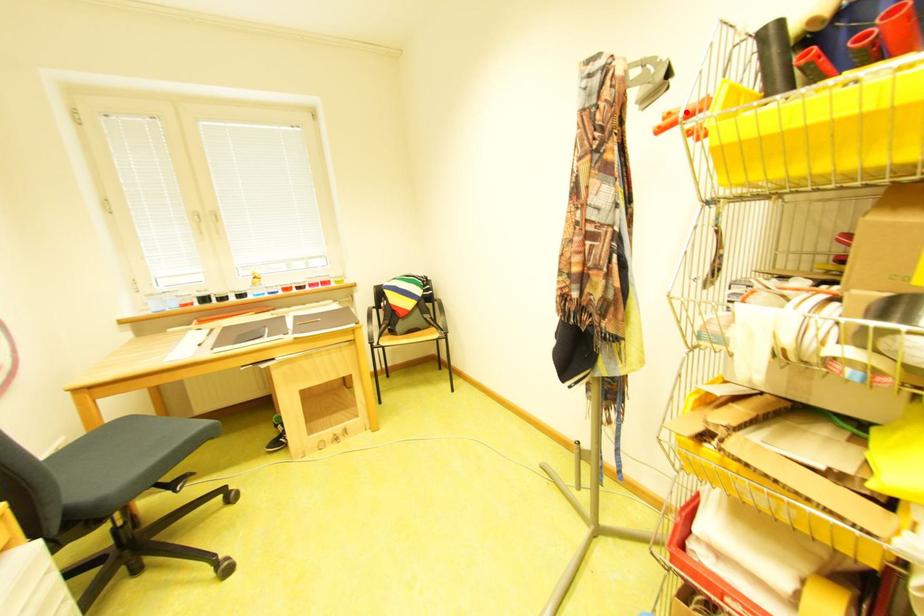
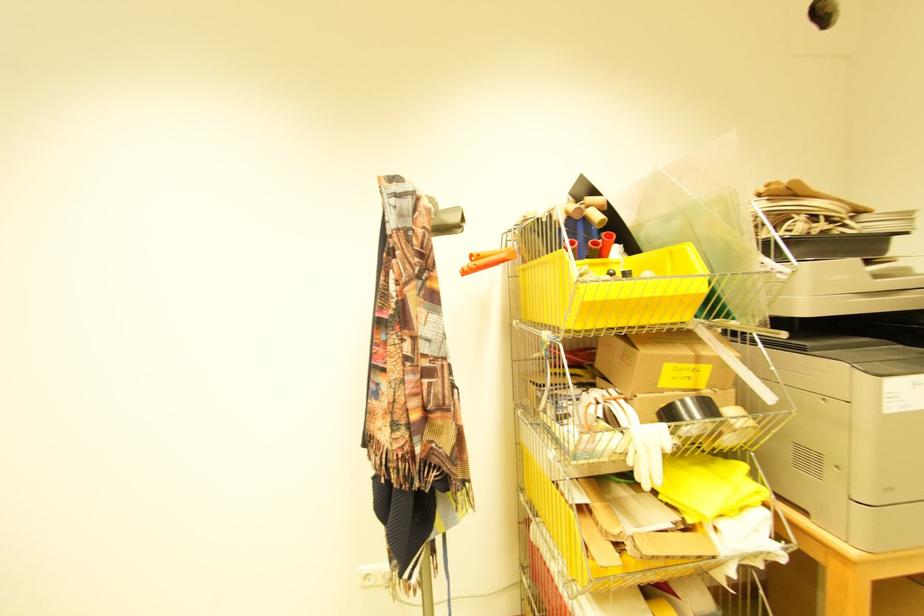
Locate, in the second image, the point that corresponds to the highlighted location in the first image.

(492, 254)